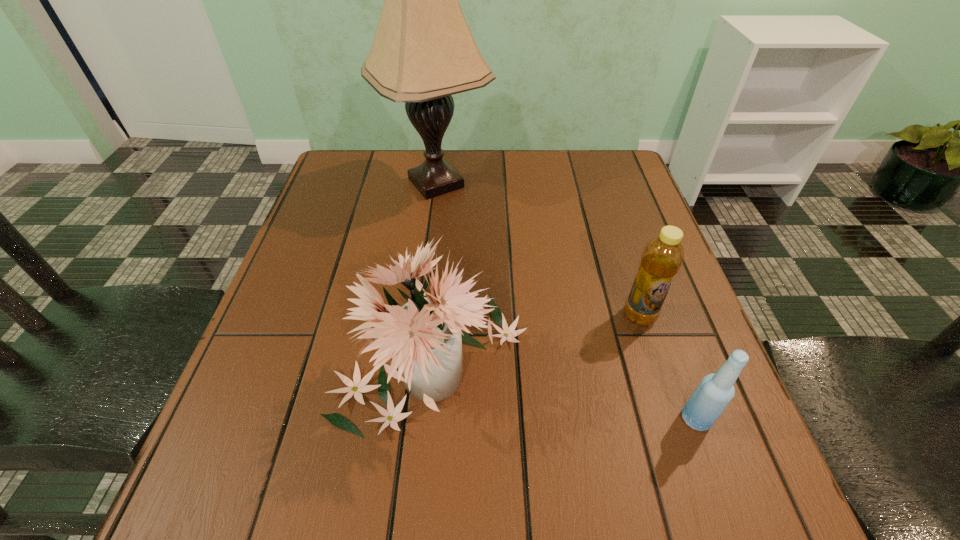
Locate an element on the screen. This screenshot has width=960, height=540. vacant space situated on the left of the shortest object is located at coordinates (449, 419).

Find the location of a particular element. object at the far edge is located at coordinates (423, 52).

Find the location of a particular element. This screenshot has width=960, height=540. lamp at the left edge is located at coordinates (423, 52).

You are a GUI agent. You are given a task and a screenshot of the screen. Output one action in this format:
    pyautogui.click(x=<x>, y=<y>)
    Task: Click on the bouquet that is at the left edge
    This screenshot has width=960, height=540.
    Given the screenshot: What is the action you would take?
    pyautogui.click(x=424, y=338)

The height and width of the screenshot is (540, 960). In order to click on object that is at the far left corner in this screenshot , I will do `click(423, 52)`.

Find the location of a particular element. The height and width of the screenshot is (540, 960). vacant space at the far edge of the desktop is located at coordinates (531, 165).

Where is `free space at the near edge of the desktop`? The width and height of the screenshot is (960, 540). free space at the near edge of the desktop is located at coordinates (455, 473).

This screenshot has height=540, width=960. In order to click on vacant area at the left edge in this screenshot , I will do `click(315, 312)`.

The image size is (960, 540). Identify the location of blank space at the right edge of the desktop. (603, 255).

In the image, there is a desktop. Where is `vacant area at the far right corner`? This screenshot has width=960, height=540. vacant area at the far right corner is located at coordinates (602, 171).